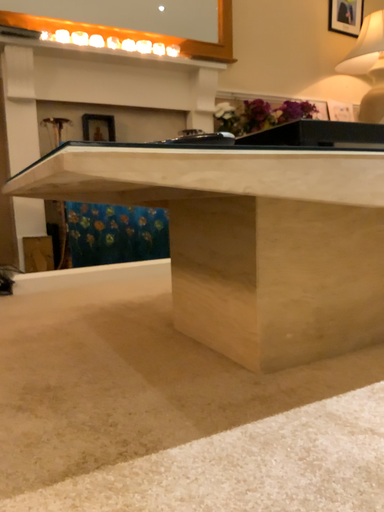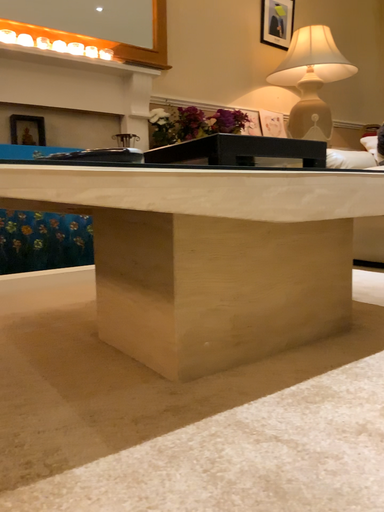
Question: Which way did the camera rotate in the video?

Choices:
 (A) rotated right
 (B) rotated left

Answer: (A)